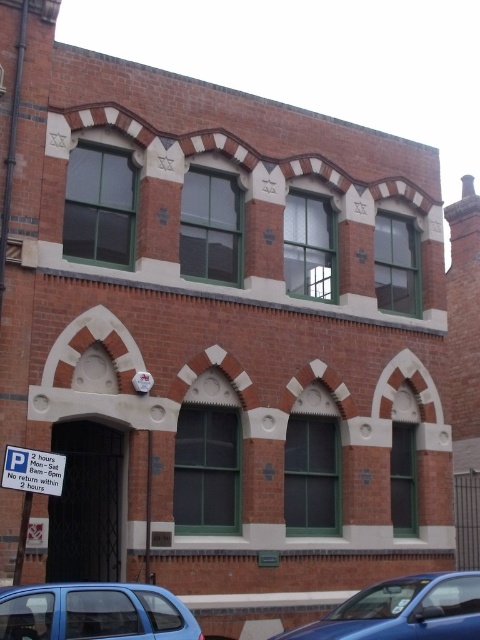
You are standing in front of the brick building with arched windows and doorways. You notice a point labeled at coordinates (404, 611). What object does this point correspond to?

The point corresponds to the blue glossy car at lower right.

You are a delivery driver who needs to park your blue metallic hatchback at lower left near the entrance of the brick building. However, there is a metallic rectangular sign at lower left in the way. Can you park your car there without blocking the sign?

The blue metallic hatchback at lower left is in front of the metallic rectangular sign at lower left, so parking the car there would block the sign.

You are standing in front of the brick building and see the blue glossy car at lower right and the metallic rectangular sign at lower left. Which object is positioned to the right side of the other?

The blue glossy car at lower right is positioned to the right of the metallic rectangular sign at lower left.